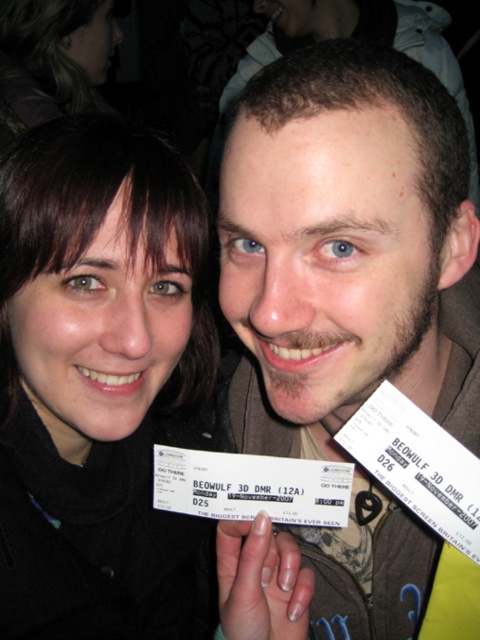
Is black matte ticket at center positioned at the back of brown textured jacket at center?

That is True.

Find the location of a particular element. The width and height of the screenshot is (480, 640). black matte ticket at center is located at coordinates (97, 381).

Where is `black matte ticket at center`? black matte ticket at center is located at coordinates 97,381.